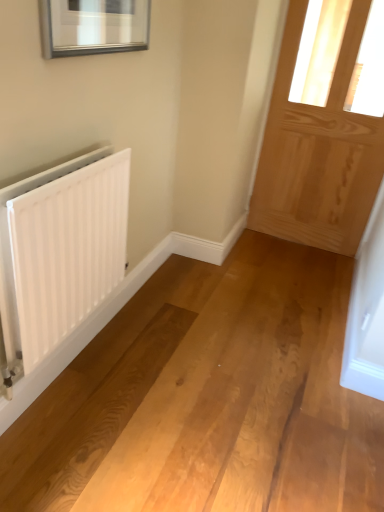
You are a GUI agent. You are given a task and a screenshot of the screen. Output one action in this format:
    pyautogui.click(x=<x>, y=<y>)
    Task: Click on the vacant space positioned to the left of natural wood door at right
    The image size is (384, 512).
    Given the screenshot: What is the action you would take?
    pyautogui.click(x=262, y=247)